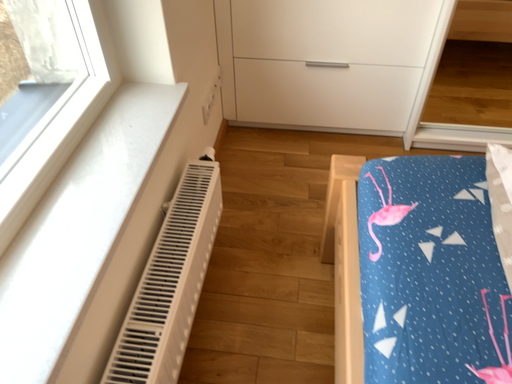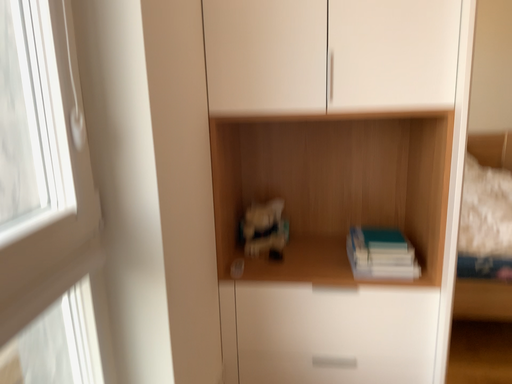
Question: Which way did the camera rotate in the video?

Choices:
 (A) rotated downward
 (B) rotated upward

Answer: (B)